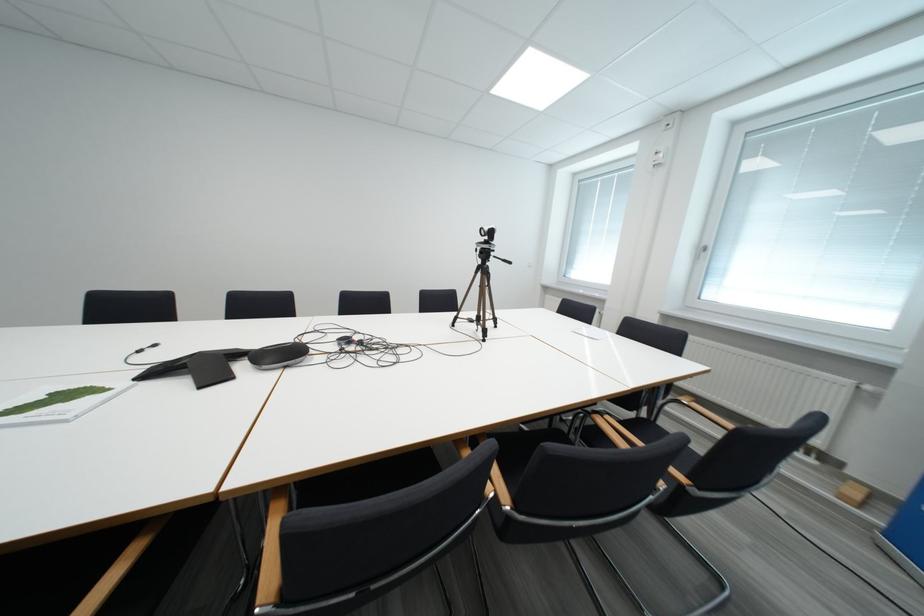
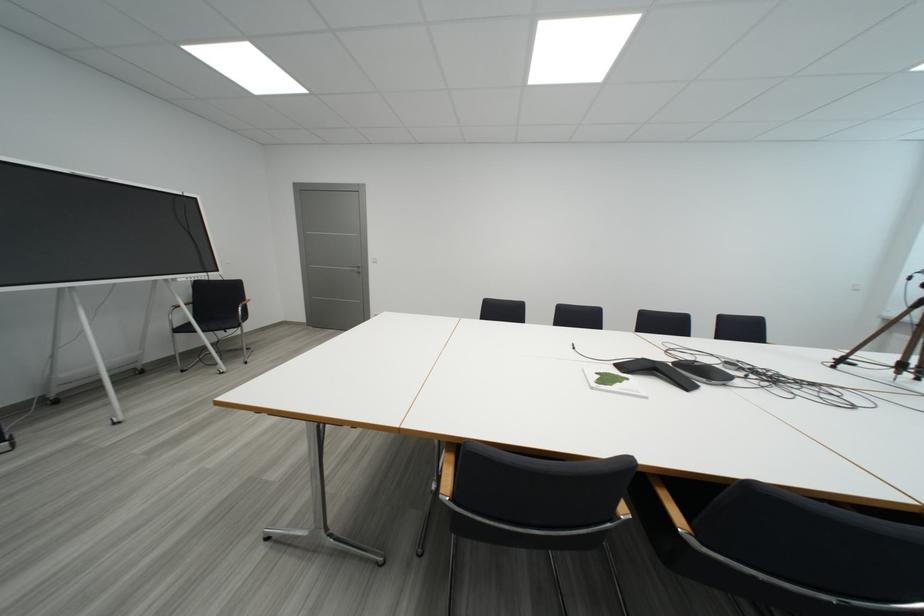
The point at (312, 342) is marked in the first image. Where is the corresponding point in the second image?

(697, 361)